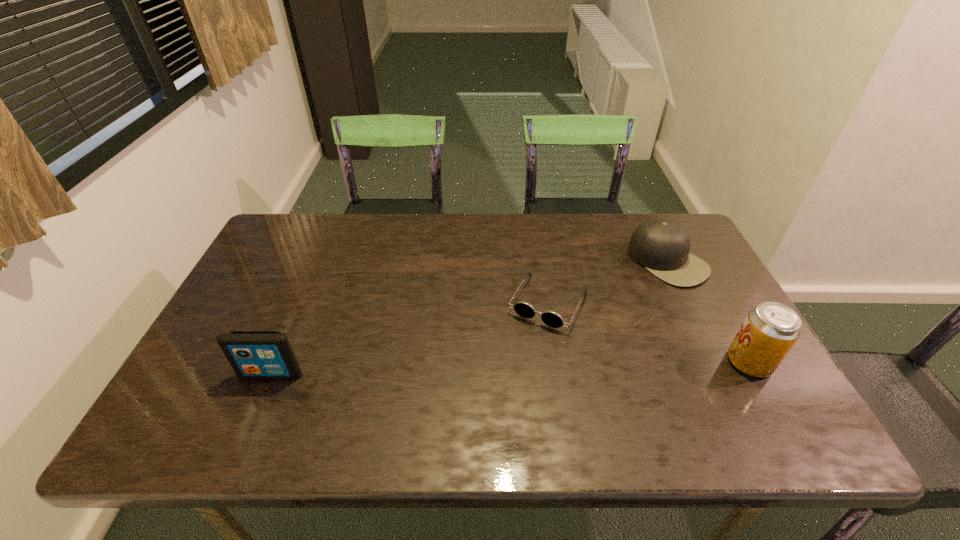
At what (x,y) coordinates should I click in order to perform the action: click on the second closest object to the third object from right to left. Please return your answer as a coordinate pair (x, y). Looking at the image, I should click on (770, 330).

This screenshot has width=960, height=540. I want to click on free spot that satisfies the following two spatial constraints: 1. on the front side of the pop (soda); 2. on the left side of the second object from left to right, so click(x=558, y=362).

Find the location of `vacant area in the image that satisfies the following two spatial constraints: 1. on the front side of the second object from left to right; 2. on the left side of the pop (soda)`. vacant area in the image that satisfies the following two spatial constraints: 1. on the front side of the second object from left to right; 2. on the left side of the pop (soda) is located at coordinates (558, 362).